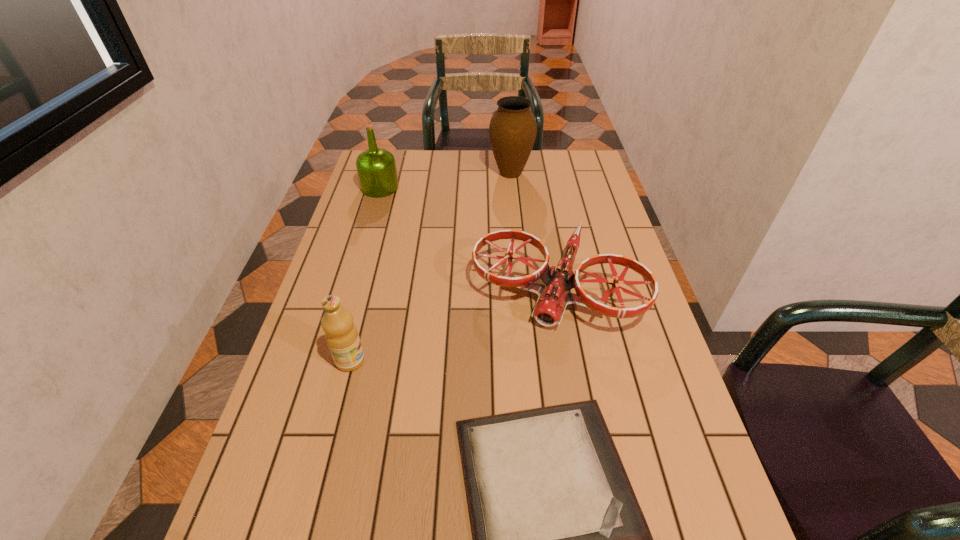
The image size is (960, 540). I want to click on urn, so click(x=512, y=131).

At what (x,y) coordinates should I click in order to perform the action: click on the farther olive oil. Please return your answer as a coordinate pair (x, y). Looking at the image, I should click on (376, 167).

Locate an element on the screen. This screenshot has width=960, height=540. the nearer olive oil is located at coordinates (341, 334).

The height and width of the screenshot is (540, 960). I want to click on the third nearest object, so click(x=553, y=298).

This screenshot has width=960, height=540. Identify the location of drone. (553, 298).

Where is `free region located on the left of the urn`? Image resolution: width=960 pixels, height=540 pixels. free region located on the left of the urn is located at coordinates (454, 173).

Where is `vacant space located on the front of the farther olive oil`? The height and width of the screenshot is (540, 960). vacant space located on the front of the farther olive oil is located at coordinates (371, 220).

At what (x,y) coordinates should I click in order to perform the action: click on vacant space situated 0.270m on the label of the nearer olive oil. Please return your answer as a coordinate pair (x, y). Looking at the image, I should click on (476, 361).

Where is `vacant space located on the back of the third farthest object`? This screenshot has height=540, width=960. vacant space located on the back of the third farthest object is located at coordinates (543, 220).

Locate an element on the screen. This screenshot has height=540, width=960. urn located in the far edge section of the desktop is located at coordinates click(512, 131).